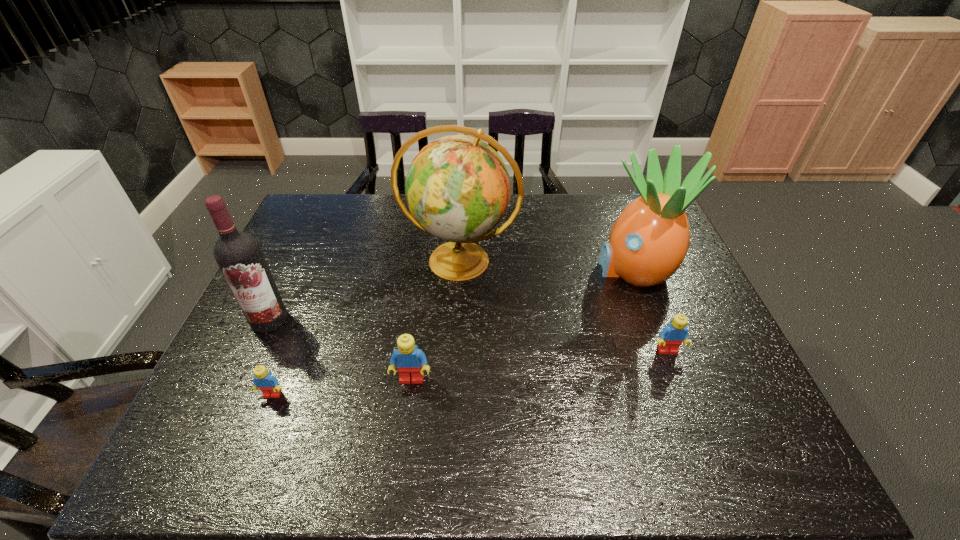
Where is `Lego that is at the right edge`? This screenshot has height=540, width=960. Lego that is at the right edge is located at coordinates (671, 337).

Find the location of a particular element. This screenshot has height=540, width=960. pineapple positioned at the right edge is located at coordinates (648, 242).

Image resolution: width=960 pixels, height=540 pixels. What are the coordinates of `object at the near left corner` in the screenshot? It's located at (266, 382).

Find the location of `free point at the far edge`. free point at the far edge is located at coordinates (570, 216).

Identify the location of free space at the near edge of the desktop. (444, 405).

In the image, there is a desktop. Where is `vacant space at the left edge`? Image resolution: width=960 pixels, height=540 pixels. vacant space at the left edge is located at coordinates point(289,238).

The image size is (960, 540). What are the coordinates of `vacant space at the right edge of the desktop` in the screenshot? It's located at (660, 299).

In the image, there is a desktop. At what (x,y) coordinates should I click in order to perform the action: click on blank space at the far left corner. Please return your answer as a coordinate pair (x, y). This screenshot has height=540, width=960. Looking at the image, I should click on (306, 218).

The height and width of the screenshot is (540, 960). In order to click on vacant space in between the nearest Lego and the leftmost object in this screenshot , I will do `click(271, 357)`.

Where is `free area in between the fifth object from right to left and the globe`? Image resolution: width=960 pixels, height=540 pixels. free area in between the fifth object from right to left and the globe is located at coordinates (366, 328).